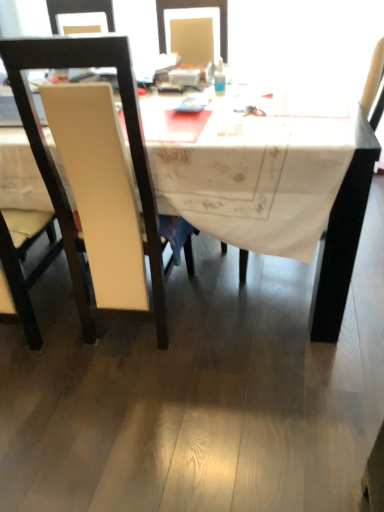
Question: Can you confirm if white fabric table at center is smaller than white matte chair at left, which is the 2th chair in right-to-left order?

Choices:
 (A) yes
 (B) no

Answer: (B)

Question: Can you confirm if white fabric table at center is taller than white matte chair at left, the first chair in the left-to-right sequence?

Choices:
 (A) no
 (B) yes

Answer: (A)

Question: From the image's perspective, is white fabric table at center above white matte chair at left, which is the 2th chair in right-to-left order?

Choices:
 (A) yes
 (B) no

Answer: (A)

Question: From the image's perspective, is white fabric table at center under white matte chair at left, which is the 2th chair in right-to-left order?

Choices:
 (A) yes
 (B) no

Answer: (B)

Question: Could you tell me if white fabric table at center is turned towards white matte chair at left, which is the 2th chair in right-to-left order?

Choices:
 (A) no
 (B) yes

Answer: (B)

Question: In terms of width, does white leather chair at left, positioned as the 2th chair in left-to-right order, look wider or thinner when compared to translucent plastic bottle at upper center?

Choices:
 (A) thin
 (B) wide

Answer: (B)

Question: In the image, is white leather chair at left, placed as the first chair when sorted from right to left, positioned in front of or behind translucent plastic bottle at upper center?

Choices:
 (A) front
 (B) behind

Answer: (A)

Question: From the image's perspective, is white leather chair at left, positioned as the 2th chair in left-to-right order, located above or below translucent plastic bottle at upper center?

Choices:
 (A) below
 (B) above

Answer: (A)

Question: In terms of size, does white leather chair at left, placed as the first chair when sorted from right to left, appear bigger or smaller than translucent plastic bottle at upper center?

Choices:
 (A) big
 (B) small

Answer: (A)

Question: Considering the positions of translucent plastic bottle at upper center and white fabric table at center in the image, is translucent plastic bottle at upper center bigger or smaller than white fabric table at center?

Choices:
 (A) small
 (B) big

Answer: (A)

Question: From the image's perspective, relative to white fabric table at center, is translucent plastic bottle at upper center above or below?

Choices:
 (A) above
 (B) below

Answer: (A)

Question: From a real-world perspective, is translucent plastic bottle at upper center above or below white fabric table at center?

Choices:
 (A) below
 (B) above

Answer: (B)

Question: Does point (218, 66) appear closer or farther from the camera than point (34, 120)?

Choices:
 (A) farther
 (B) closer

Answer: (A)

Question: From a real-world perspective, is white leather chair at left, placed as the first chair when sorted from right to left, positioned above or below white fabric table at center?

Choices:
 (A) above
 (B) below

Answer: (A)

Question: Looking at their shapes, would you say white leather chair at left, placed as the first chair when sorted from right to left, is wider or thinner than white fabric table at center?

Choices:
 (A) wide
 (B) thin

Answer: (B)